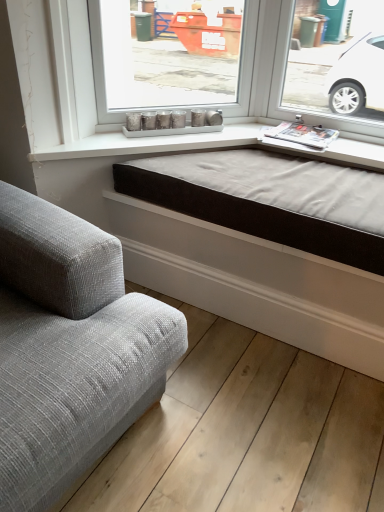
Question: Is textured gray fabric couch at lower left to the left of brown fabric bed frame at center from the viewer's perspective?

Choices:
 (A) yes
 (B) no

Answer: (A)

Question: Is textured gray fabric couch at lower left surrounding brown fabric bed frame at center?

Choices:
 (A) no
 (B) yes

Answer: (A)

Question: Is the position of textured gray fabric couch at lower left more distant than that of brown fabric bed frame at center?

Choices:
 (A) yes
 (B) no

Answer: (B)

Question: Is textured gray fabric couch at lower left not within brown fabric bed frame at center?

Choices:
 (A) no
 (B) yes

Answer: (B)

Question: From the image's perspective, is textured gray fabric couch at lower left on brown fabric bed frame at center?

Choices:
 (A) no
 (B) yes

Answer: (A)

Question: Is textured gray fabric couch at lower left facing away from brown fabric bed frame at center?

Choices:
 (A) yes
 (B) no

Answer: (B)

Question: Would you say brown fabric bed frame at center contains textured gray fabric couch at lower left?

Choices:
 (A) no
 (B) yes

Answer: (A)

Question: Can you confirm if brown fabric bed frame at center is shorter than textured gray fabric couch at lower left?

Choices:
 (A) yes
 (B) no

Answer: (A)

Question: Is brown fabric bed frame at center oriented away from textured gray fabric couch at lower left?

Choices:
 (A) yes
 (B) no

Answer: (B)

Question: Is brown fabric bed frame at center facing towards textured gray fabric couch at lower left?

Choices:
 (A) no
 (B) yes

Answer: (B)

Question: Does brown fabric bed frame at center have a lesser width compared to textured gray fabric couch at lower left?

Choices:
 (A) yes
 (B) no

Answer: (A)

Question: Considering the relative sizes of brown fabric bed frame at center and textured gray fabric couch at lower left in the image provided, is brown fabric bed frame at center bigger than textured gray fabric couch at lower left?

Choices:
 (A) yes
 (B) no

Answer: (B)

Question: Is brown fabric bed frame at center in front of or behind textured gray fabric couch at lower left in the image?

Choices:
 (A) behind
 (B) front

Answer: (A)